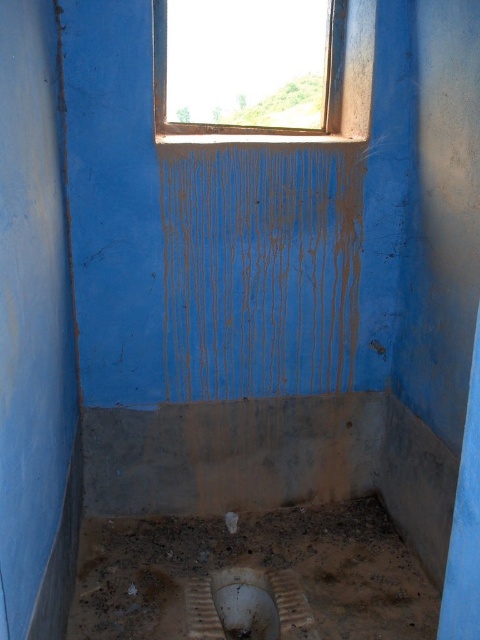
Can you confirm if metallic frame at upper center is thinner than white matte toilet bowl at lower center?

No.

Does metallic frame at upper center appear over white matte toilet bowl at lower center?

Yes.

At what (x,y) coordinates should I click in order to perform the action: click on metallic frame at upper center. Please return your answer as a coordinate pair (x, y). This screenshot has width=480, height=640. Looking at the image, I should click on (323, 83).